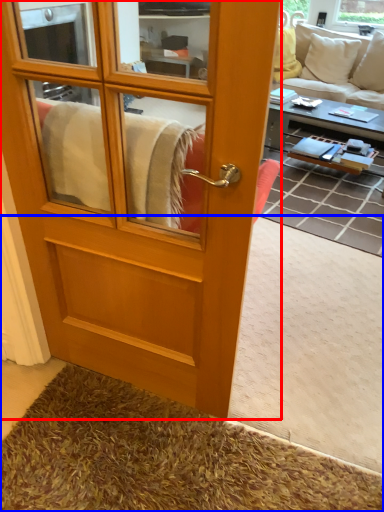
Question: Which object is further to the camera taking this photo, screen door (highlighted by a red box) or carpets (highlighted by a blue box)?

Choices:
 (A) screen door
 (B) carpets

Answer: (B)